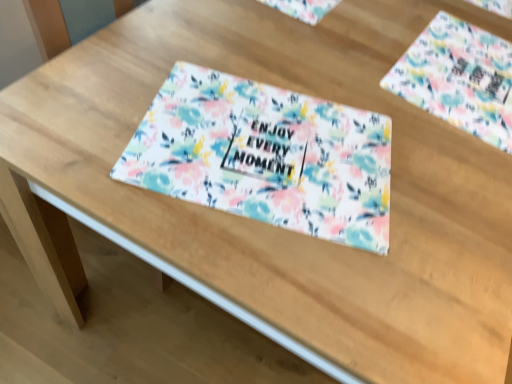
At what (x,y) coordinates should I click in order to perform the action: click on vacant space behind floral fabric placemat at center. Please return your answer as a coordinate pair (x, y). Looking at the image, I should click on (301, 50).